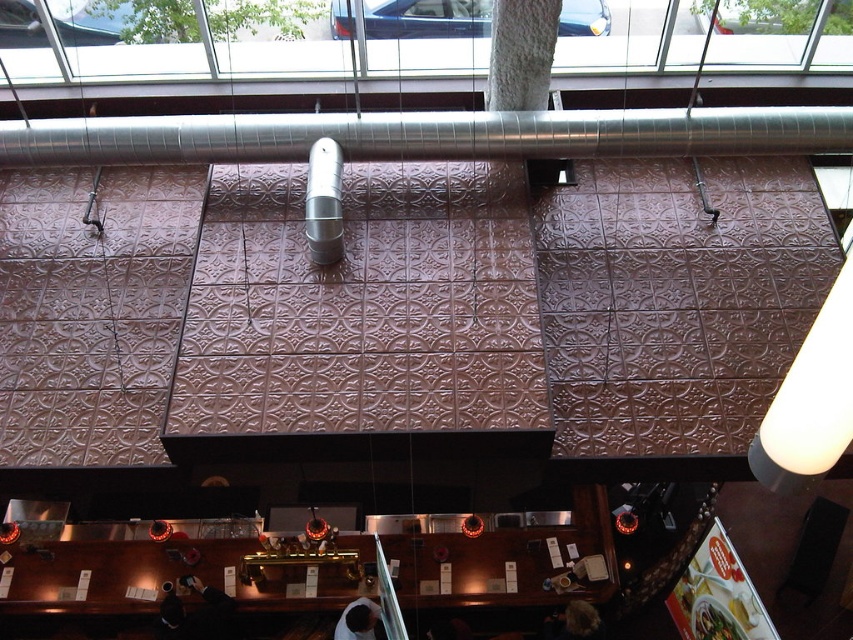
You are standing in the middle of the bar area and looking up at the ceiling. There is a point marked at coordinates (426, 134). What object is located at that point?

The point at coordinates (426, 134) corresponds to the silver metallic exhaust hood at upper center.

You are a painter who needs to reach both the silver metallic exhaust hood at upper center and the white matte lampshade at upper right to touch up some paint. Your ladder can extend up to 4 meters. If you place the ladder exactly at the midpoint between them, will you be able to reach both objects without moving the ladder?

The silver metallic exhaust hood at upper center is 3.94 meters away from the white matte lampshade at upper right. The midpoint between them would require the ladder to reach both objects. Since the distance between them is less than 4 meters, placing the ladder at the midpoint would allow you to reach both objects within the ladder extension limit of 4 meters.

Looking at this image, you are a painter hired to paint the ceiling of the modern cafe. You have two ladders available, one small and one large. The silver metallic exhaust hood at upper center and the white matte lampshade at upper right are in your way. Which ladder should you choose to reach both objects without needing to move them?

The silver metallic exhaust hood at upper center occupies less space than the white matte lampshade at upper right. Therefore, the large ladder is needed to accommodate the larger size of the white matte lampshade at upper right, ensuring you can reach both objects without moving them.